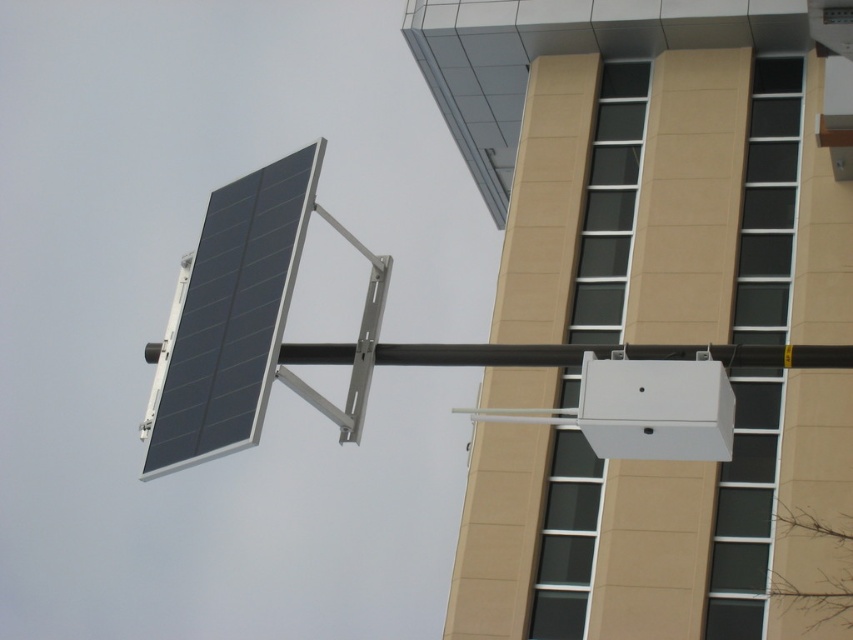
Question: Is black matte solar panel at upper left smaller than black matte pole at center?

Choices:
 (A) no
 (B) yes

Answer: (A)

Question: Is black matte solar panel at upper left smaller than black matte pole at center?

Choices:
 (A) no
 (B) yes

Answer: (A)

Question: Observing the image, what is the correct spatial positioning of black matte solar panel at upper left in reference to black matte pole at center?

Choices:
 (A) left
 (B) right

Answer: (A)

Question: Which object is farther from the camera taking this photo?

Choices:
 (A) black matte solar panel at upper left
 (B) black matte pole at center

Answer: (B)

Question: Which of the following is the closest to the observer?

Choices:
 (A) (683, 348)
 (B) (241, 308)

Answer: (A)